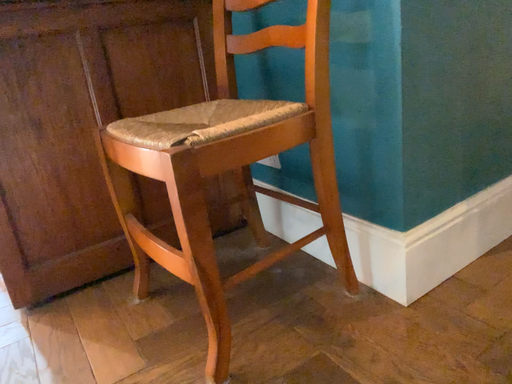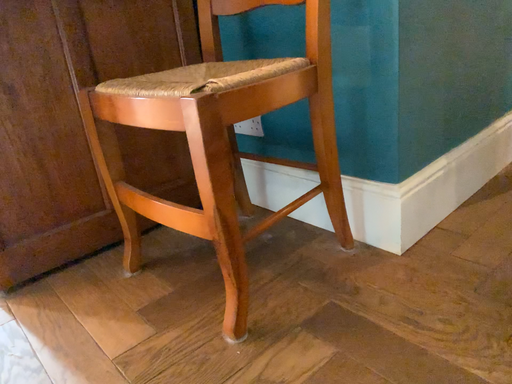
Question: Which way did the camera rotate in the video?

Choices:
 (A) rotated right
 (B) rotated left

Answer: (A)